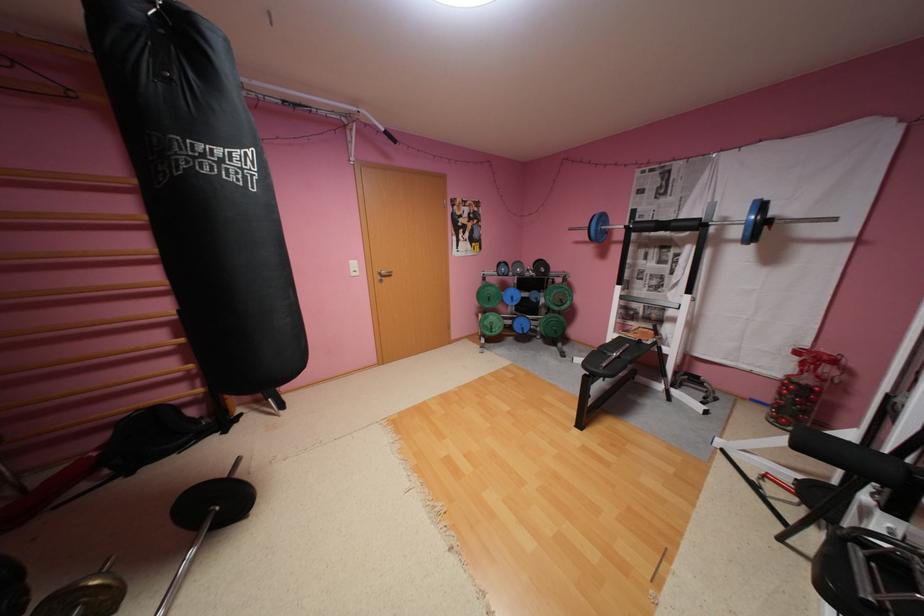
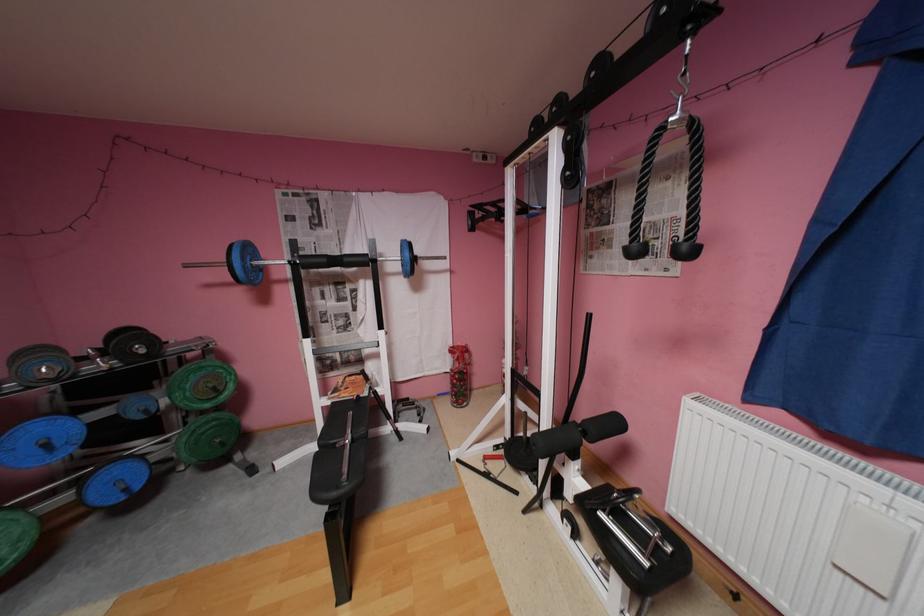
Locate, in the second image, the point that corresponds to point (531, 329) in the first image.

(134, 488)